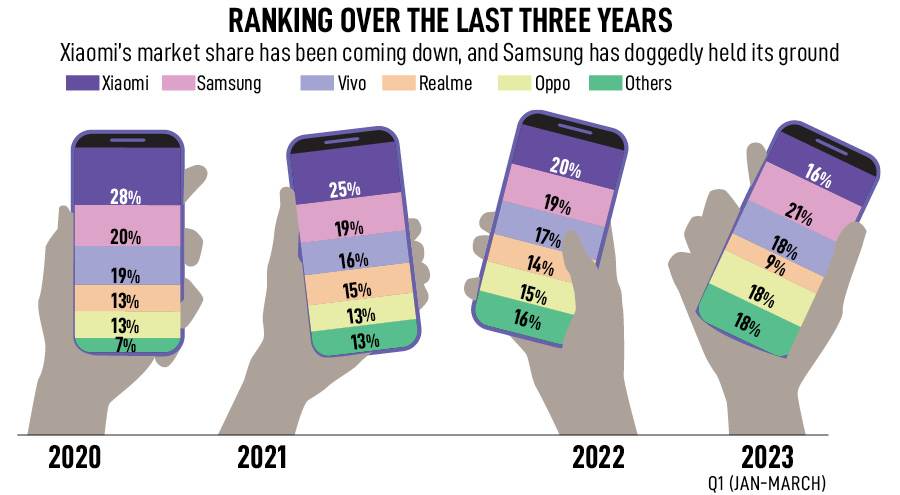
Identify the location of phone. This screenshot has height=495, width=900. (149, 138), (363, 133), (563, 117), (834, 130), (801, 117).